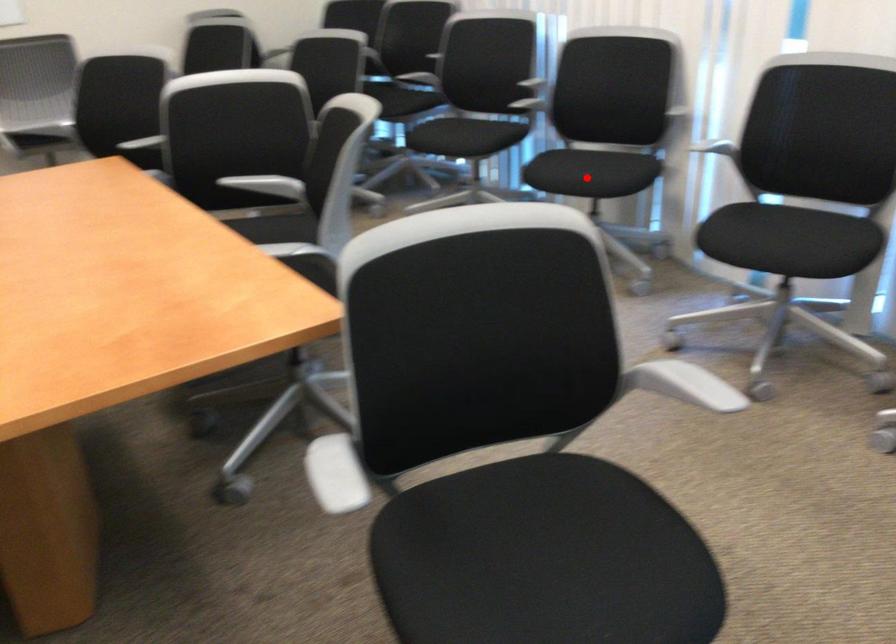
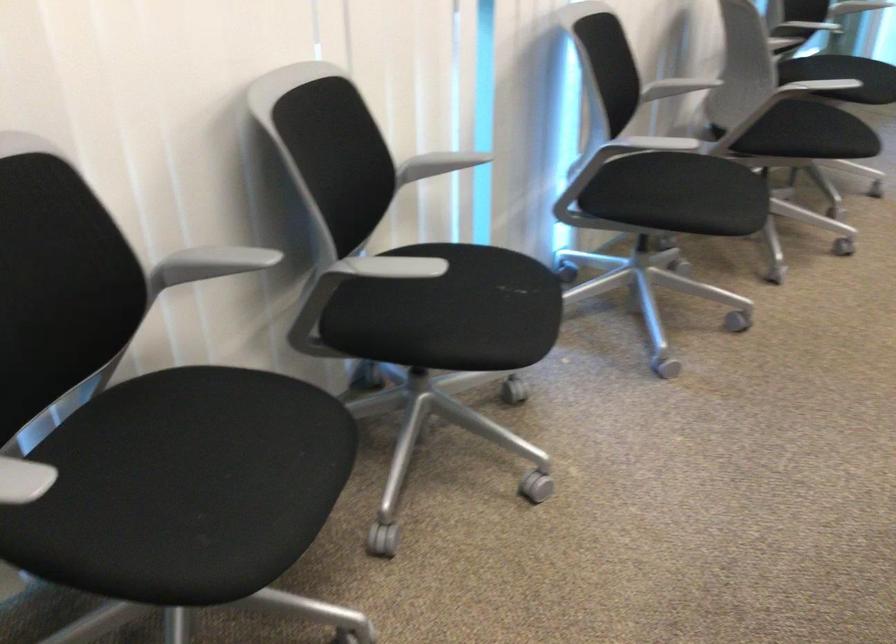
Where in the second image is the point corresponding to the highlighted location from the first image?

(515, 287)